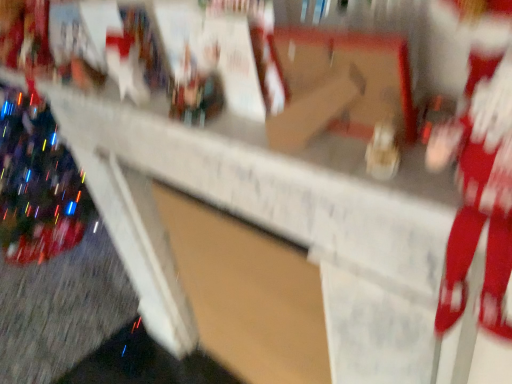
Image resolution: width=512 pixels, height=384 pixels. I want to click on red plush santa at right, so click(480, 168).

In order to face red plush santa at right, should I rotate leftwards or rightwards?

To face it directly, rotate right by 28.268 degrees.

This screenshot has height=384, width=512. What do you see at coordinates (480, 168) in the screenshot?
I see `red plush santa at right` at bounding box center [480, 168].

Find the location of a particular element. The width and height of the screenshot is (512, 384). red plush santa at right is located at coordinates pos(480,168).